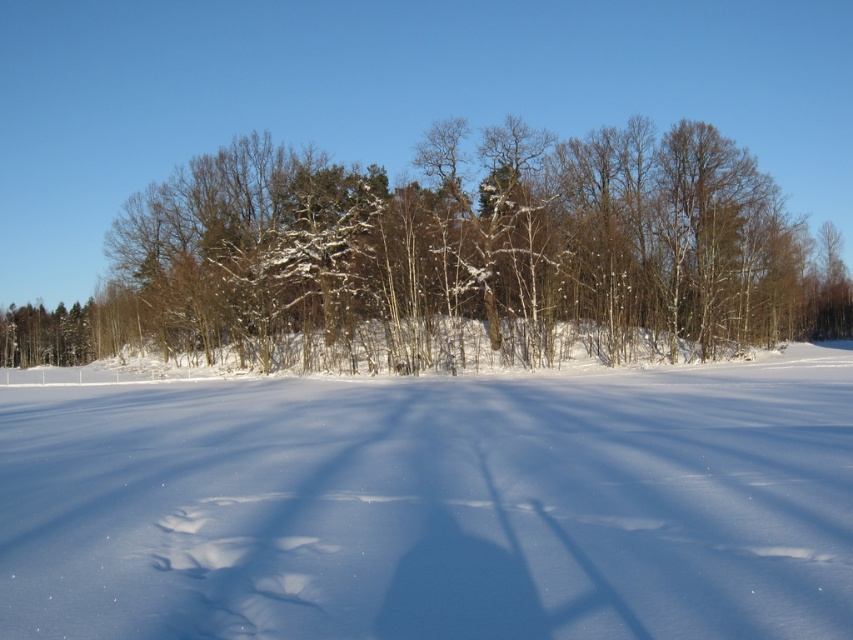
Does white powdery snow at center have a smaller size compared to snow-covered trees at center?

Correct, white powdery snow at center occupies less space than snow-covered trees at center.

Between point (834, 364) and point (425, 269), which one is positioned in front?

Positioned in front is point (834, 364).

This screenshot has width=853, height=640. Find the location of `white powdery snow at center`. white powdery snow at center is located at coordinates (434, 506).